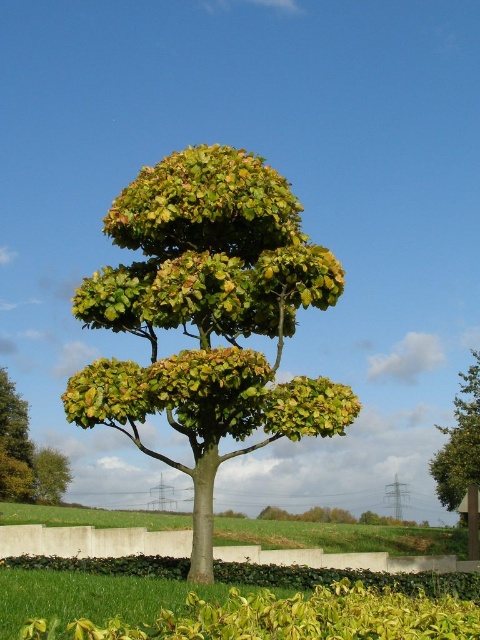
Can you confirm if green grass at lower center is bigger than green leafy tree at lower left?

Indeed, green grass at lower center has a larger size compared to green leafy tree at lower left.

Is green grass at lower center taller than green leafy tree at lower left?

Yes, green grass at lower center is taller than green leafy tree at lower left.

Locate an element on the screen. green grass at lower center is located at coordinates (342, 536).

Locate an element on the screen. Image resolution: width=480 pixels, height=640 pixels. green grass at lower center is located at coordinates (342, 536).

Can you confirm if green leafy tree at right is positioned below green leafy tree at left?

No, green leafy tree at right is not below green leafy tree at left.

Between point (456, 445) and point (14, 435), which one is positioned behind?

Positioned behind is point (14, 435).

Between point (475, 556) and point (1, 493), which one is positioned behind?

The point (1, 493) is more distant.

The image size is (480, 640). Find the location of `green leafy tree at right`. green leafy tree at right is located at coordinates (462, 456).

Who is positioned more to the right, green grass at lower center or green leafy tree at right?

From the viewer's perspective, green leafy tree at right appears more on the right side.

Looking at this image, can you confirm if green grass at lower center is bigger than green leafy tree at right?

Indeed, green grass at lower center has a larger size compared to green leafy tree at right.

Which is behind, point (273, 540) or point (450, 499)?

The point (450, 499) is behind.

Identify the location of green grass at lower center. (x=342, y=536).